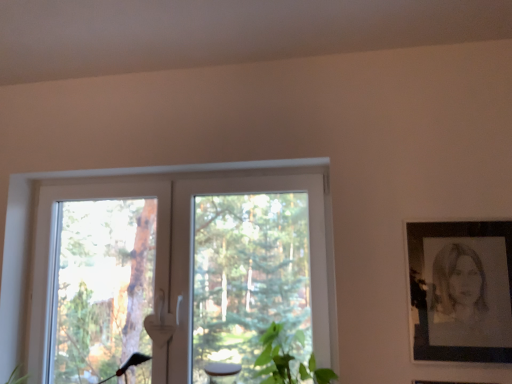
Question: From the image's perspective, is white plastic window at center positioned above or below black paper portrait at right?

Choices:
 (A) below
 (B) above

Answer: (A)

Question: Relative to black paper portrait at right, is white plastic window at center in front or behind?

Choices:
 (A) behind
 (B) front

Answer: (A)

Question: Which object is positioned closest to the green leafy plant at lower center?

Choices:
 (A) black paper portrait at right
 (B) white plastic window at center

Answer: (B)

Question: Which of these objects is positioned farthest from the green leafy plant at lower center?

Choices:
 (A) black paper portrait at right
 (B) white plastic window at center

Answer: (A)